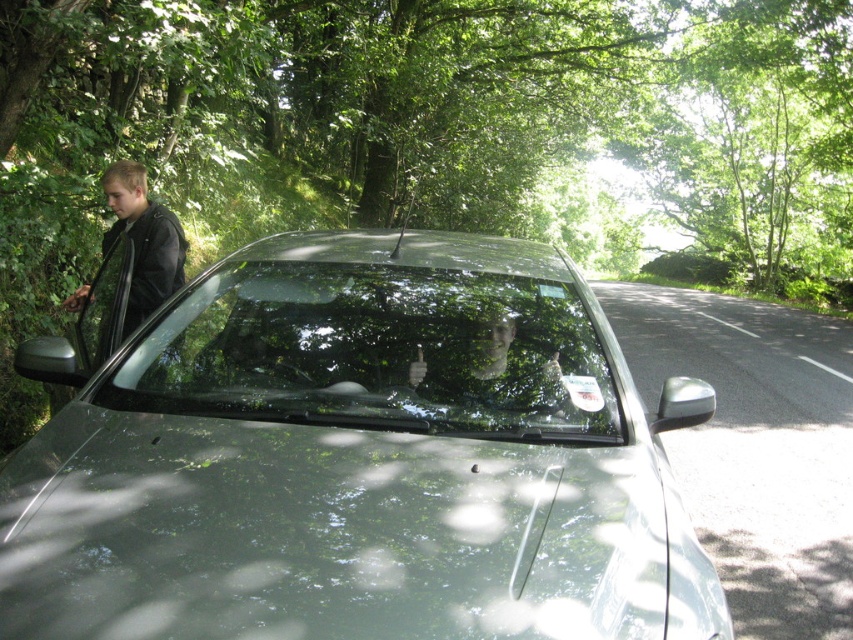
Question: Is clear glass windshield at center to the right of black leather jacket at left from the viewer's perspective?

Choices:
 (A) yes
 (B) no

Answer: (A)

Question: Based on their relative distances, which object is nearer to the green leafy tree at upper center?

Choices:
 (A) clear glass windshield at center
 (B) black leather jacket at left

Answer: (A)

Question: Which of the following is the farthest from the observer?

Choices:
 (A) green leafy tree at upper center
 (B) satin silver car at center
 (C) matte black face at center
 (D) black leather jacket at left

Answer: (A)

Question: Is the position of satin silver car at center less distant than that of black leather jacket at left?

Choices:
 (A) no
 (B) yes

Answer: (B)

Question: Is the position of green leafy tree at upper center more distant than that of clear glass windshield at center?

Choices:
 (A) no
 (B) yes

Answer: (B)

Question: Which point is farther to the camera?

Choices:
 (A) satin silver car at center
 (B) black leather jacket at left
 (C) green leafy tree at upper center
 (D) matte black face at center

Answer: (C)